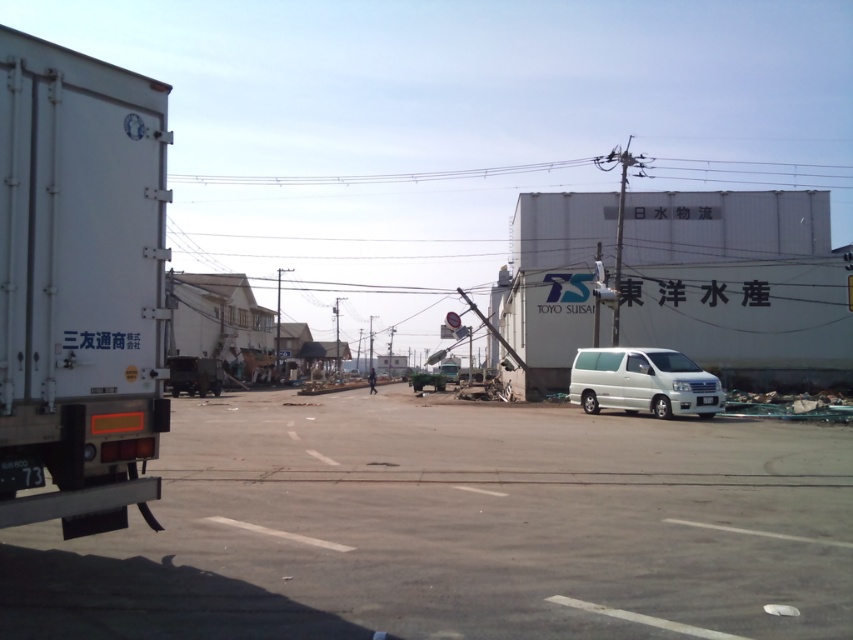
You are a delivery driver who needs to park your van in the gray asphalt parking lot at center. Your van is the same size as the white metallic van at center. Can you fit your van into the parking lot at center?

The gray asphalt parking lot at center is wider than the white metallic van at center, so yes, your van can fit into the parking lot at center.

You are standing in the urban industrial area shown in the image. You see two points marked as point 1 at coordinates point (x=268, y=509) and point 2 at coordinates point (x=666, y=356). Which point is closer to you?

Point (x=268, y=509) is closer to you than point (x=666, y=356).

In the scene shown: You are a delivery driver who needs to park your vehicle in the gray asphalt parking lot at center. Your truck is as wide as the white matte truck at left. Will your truck fit into the parking space?

The gray asphalt parking lot at center is wider than the white matte truck at left, so your truck, being the same width, will fit into the parking space.